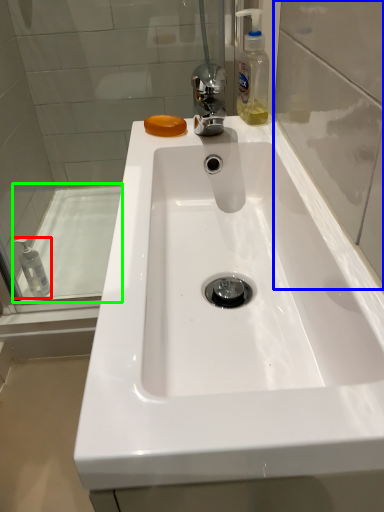
Question: Which is nearer to the mouthwash (highlighted by a red box)? glass door (highlighted by a blue box) or bath (highlighted by a green box).

Choices:
 (A) glass door
 (B) bath

Answer: (B)